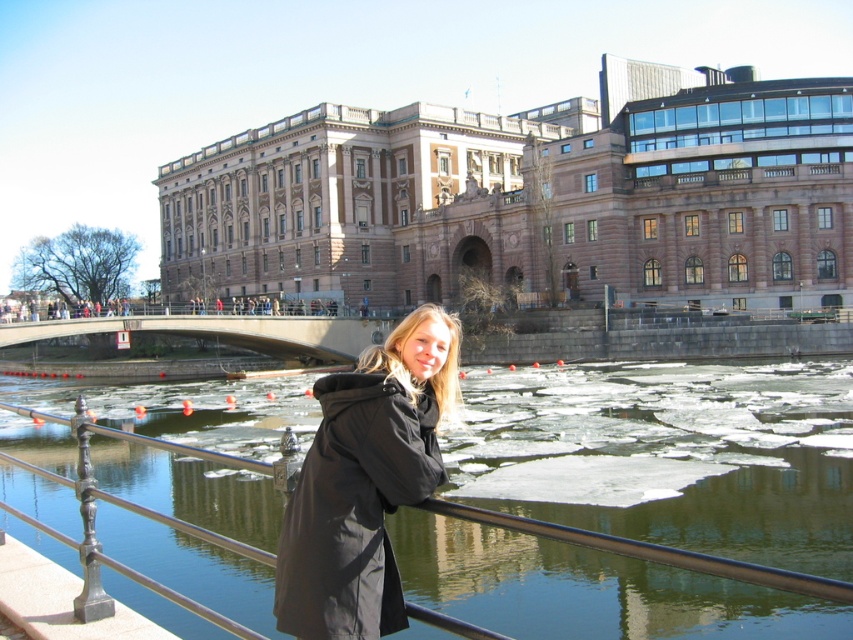
Consider the image. You are a tourist standing at the railing and want to take a photo of the clear water at center and the concrete gray bridge at center. Which object should you focus on first if you want both to be in sharp focus?

You should focus on the concrete gray bridge at center first because it is farther away than the clear water at center, ensuring both will be in focus when using depth of field.

You are a photographer trying to capture the historic building in the background without any obstructions. You notice a point marked at coordinates point (669, 454). What is located at this point that might block your view of the historic building?

The point (669, 454) marks clear water at center, so there is no obstruction at this point, allowing an unobstructed view of the historic building.